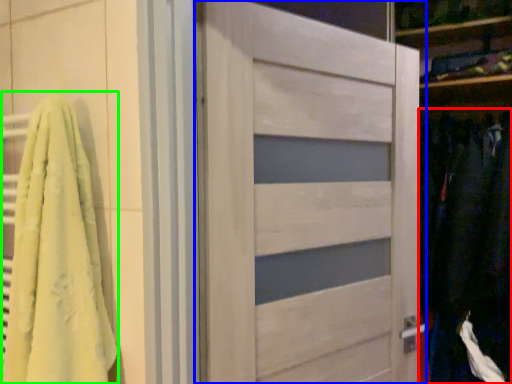
Question: Which object is positioned closest to clothing (highlighted by a red box)? Select from door (highlighted by a blue box) and bath towel (highlighted by a green box).

Choices:
 (A) door
 (B) bath towel

Answer: (A)